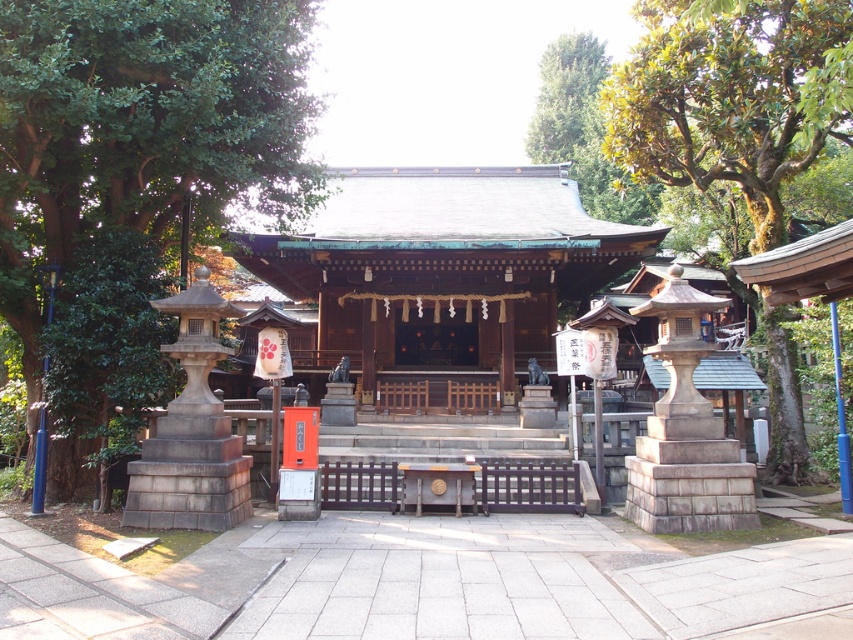
You are standing in front of the shrine and notice two trees in the upper part of the image. Which tree is positioned more to the left side when looking at the green mossy tree at upper right and the green leafy tree at upper center?

The green mossy tree at upper right is positioned more to the left side compared to the green leafy tree at upper center.

Consider the image. You are a photographer planning to take a picture of both the green leafy tree at left and the green mossy tree at upper right in the shrine area. The minimum distance between the trees required for your camera lens to focus on both is 5 meters. Can you capture both trees in focus with your current settings?

The green leafy tree at left and green mossy tree at upper right are 6.64 meters apart from each other. Since the minimum required distance for your camera lens to focus on both is 5 meters, you can capture both trees in focus with your current settings as 6.64 meters exceeds the 5 meters requirement.